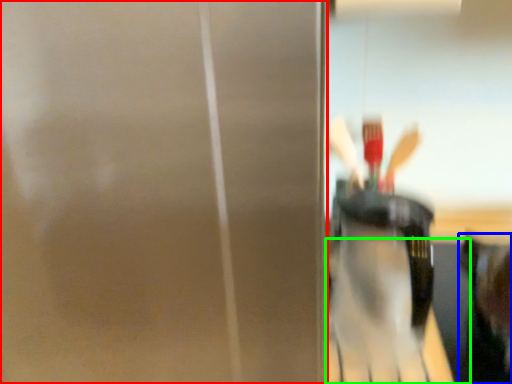
Question: Based on their relative distances, which object is nearer to screen door (highlighted by a red box)? Choose from person (highlighted by a blue box) and table (highlighted by a green box).

Choices:
 (A) person
 (B) table

Answer: (A)